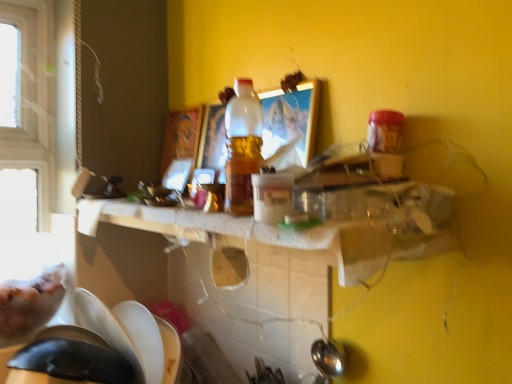
Where is `translucent plastic bottle at center`? The width and height of the screenshot is (512, 384). translucent plastic bottle at center is located at coordinates (242, 147).

What do you see at coordinates (242, 147) in the screenshot? The height and width of the screenshot is (384, 512). I see `translucent plastic bottle at center` at bounding box center [242, 147].

The height and width of the screenshot is (384, 512). In order to click on white paper towel at center in this screenshot , I will do `click(319, 226)`.

What is the approximate height of white paper towel at center?

The height of white paper towel at center is 6.15 centimeters.

The image size is (512, 384). Describe the element at coordinates (319, 226) in the screenshot. I see `white paper towel at center` at that location.

In order to face white paper towel at center, should I rotate leftwards or rightwards?

To align with it, rotate left about 4.973°.

Measure the distance between point [357,261] and camera.

They are 21.06 inches apart.

The height and width of the screenshot is (384, 512). In order to click on translucent plastic bottle at center in this screenshot , I will do `click(242, 147)`.

Does translucent plastic bottle at center appear on the right side of white paper towel at center?

Yes.

In the scene shown: Is translucent plastic bottle at center in front of or behind white paper towel at center in the image?

In the image, translucent plastic bottle at center appears behind white paper towel at center.

Which is behind, point (241, 142) or point (84, 223)?

The point (84, 223) is behind.

From the image's perspective, is translucent plastic bottle at center above white paper towel at center?

Yes, from the image's perspective, translucent plastic bottle at center is over white paper towel at center.

From a real-world perspective, between translucent plastic bottle at center and white paper towel at center, who is vertically higher?

translucent plastic bottle at center is physically above.

Which object is wider, translucent plastic bottle at center or white paper towel at center?

With larger width is white paper towel at center.

Is translucent plastic bottle at center shorter than white paper towel at center?

Incorrect, the height of translucent plastic bottle at center does not fall short of that of white paper towel at center.

Considering the sizes of objects translucent plastic bottle at center and white paper towel at center in the image provided, who is smaller, translucent plastic bottle at center or white paper towel at center?

With smaller size is translucent plastic bottle at center.

Can we say translucent plastic bottle at center lies outside white paper towel at center?

translucent plastic bottle at center is positioned outside white paper towel at center.

Is translucent plastic bottle at center not near white paper towel at center?

No, translucent plastic bottle at center is not far away from white paper towel at center.

Is translucent plastic bottle at center oriented away from white paper towel at center?

No.

Where is `bottle that is on the right side of white paper towel at center`? This screenshot has width=512, height=384. bottle that is on the right side of white paper towel at center is located at coordinates (242, 147).

Which object is positioned more to the right, white paper towel at center or translucent plastic bottle at center?

Positioned to the right is translucent plastic bottle at center.

In the scene shown: In the image, is white paper towel at center positioned in front of or behind translucent plastic bottle at center?

Visually, white paper towel at center is located in front of translucent plastic bottle at center.

Is point (394, 253) closer to camera compared to point (237, 106)?

Yes, point (394, 253) is in front of point (237, 106).

From the image's perspective, would you say white paper towel at center is shown under translucent plastic bottle at center?

Yes, from the image's perspective, white paper towel at center is beneath translucent plastic bottle at center.

From a real-world perspective, is white paper towel at center located higher than translucent plastic bottle at center?

Incorrect, from a real-world perspective, white paper towel at center is lower than translucent plastic bottle at center.

Between white paper towel at center and translucent plastic bottle at center, which one has smaller width?

Thinner between the two is translucent plastic bottle at center.

Can you confirm if white paper towel at center is shorter than translucent plastic bottle at center?

Yes.

Is white paper towel at center bigger than translucent plastic bottle at center?

Correct, white paper towel at center is larger in size than translucent plastic bottle at center.

Do you think white paper towel at center is within translucent plastic bottle at center, or outside of it?

white paper towel at center cannot be found inside translucent plastic bottle at center.

Are white paper towel at center and translucent plastic bottle at center located far from each other?

That's not correct — white paper towel at center is a little close to translucent plastic bottle at center.

Could you tell me if white paper towel at center is turned towards translucent plastic bottle at center?

No, white paper towel at center is not turned towards translucent plastic bottle at center.

Measure the distance from white paper towel at center to translucent plastic bottle at center.

white paper towel at center and translucent plastic bottle at center are 6.85 inches apart.

You are a GUI agent. You are given a task and a screenshot of the screen. Output one action in this format:
    pyautogui.click(x=<x>, y=<y>)
    Task: Click on the bottle above the white paper towel at center (from the image's perspective)
    The width and height of the screenshot is (512, 384).
    Given the screenshot: What is the action you would take?
    pyautogui.click(x=242, y=147)

I want to click on counter top below the translucent plastic bottle at center (from the image's perspective), so click(x=319, y=226).

Where is `counter top that appears on the left of translucent plastic bottle at center`? The image size is (512, 384). counter top that appears on the left of translucent plastic bottle at center is located at coordinates (319, 226).